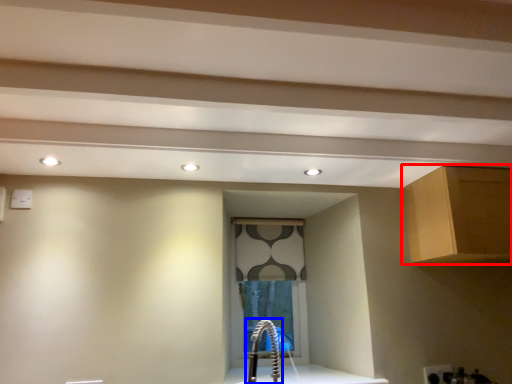
Question: Which of the following is the farthest to the observer, cabinetry (highlighted by a red box) or faucet (highlighted by a blue box)?

Choices:
 (A) cabinetry
 (B) faucet

Answer: (A)